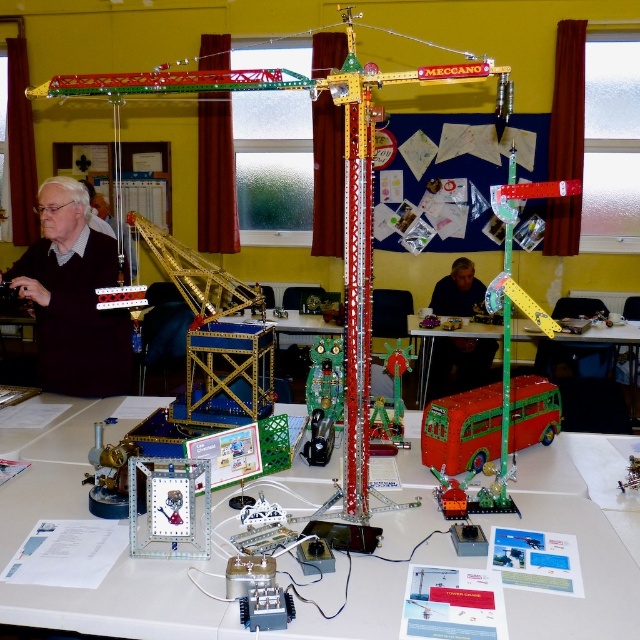
You are standing in the room where the model crane is displayed. You notice two points marked on the wall. The first point is at coordinate point [67,387] and the second point is at coordinate point [461,369]. Which point appears closer to you?

The point at coordinate point [67,387] appears closer to you because it is closer to the camera than point [461,369].

You are a photographer trying to capture a clear photo of the shiny red bus at center without any obstructions. The dark blue shirt at center is currently blocking your view. Based on the spatial relationship between these two objects, can you determine if you can move sideways to get an unobstructed shot?

The shiny red bus at center might be wider than dark blue shirt at center, so there might be space to move sideways to avoid the dark blue shirt at center and capture the shiny red bus at center without obstruction.